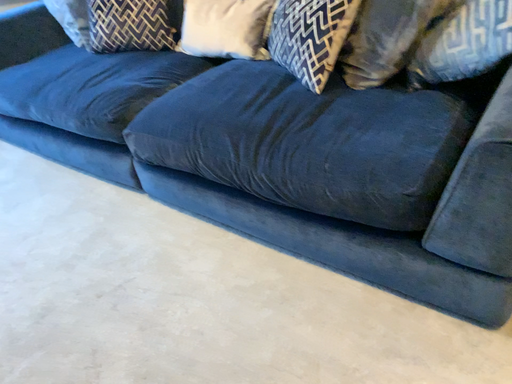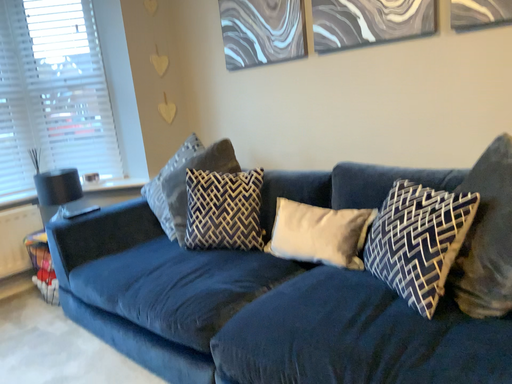
Question: Which way did the camera rotate in the video?

Choices:
 (A) rotated right
 (B) rotated left

Answer: (B)